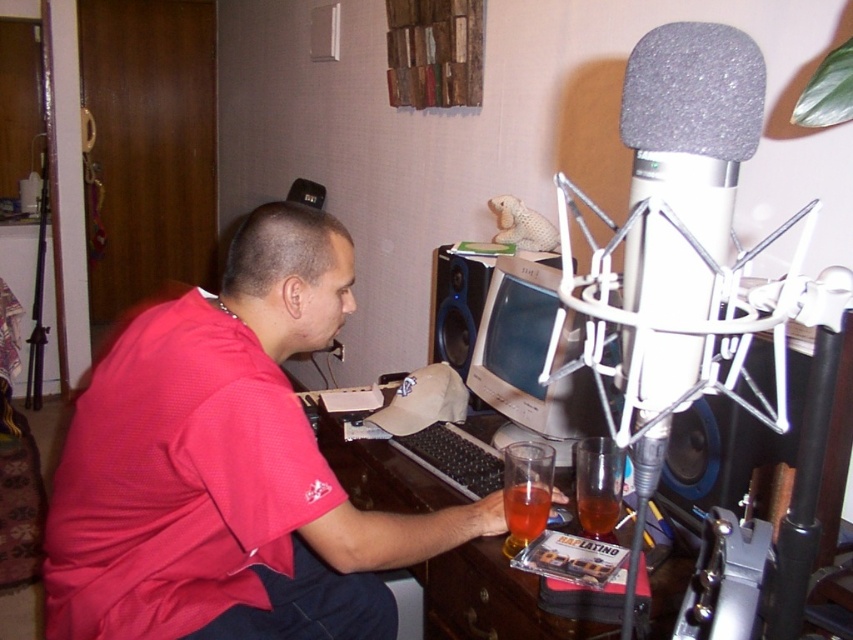
Question: Estimate the real-world distances between objects in this image. Which object is closer to the white matte microphone at upper right?

Choices:
 (A) red matte shirt at center
 (B) brown wooden drawer at lower center
 (C) matte gray monitor at center
 (D) translucent glass beverage at lower right

Answer: (A)

Question: Which point is farther to the camera?

Choices:
 (A) matte gray monitor at center
 (B) red matte shirt at center

Answer: (A)

Question: Can you confirm if black matte speaker at center is positioned above brown wooden drawer at lower center?

Choices:
 (A) no
 (B) yes

Answer: (B)

Question: Is matte gray monitor at center to the left of translucent glass at desk center from the viewer's perspective?

Choices:
 (A) no
 (B) yes

Answer: (A)

Question: Which point is closer to the camera?

Choices:
 (A) black matte speaker at center
 (B) translucent glass beverage at lower right

Answer: (A)

Question: Is red matte shirt at center below black matte speaker at center?

Choices:
 (A) no
 (B) yes

Answer: (B)